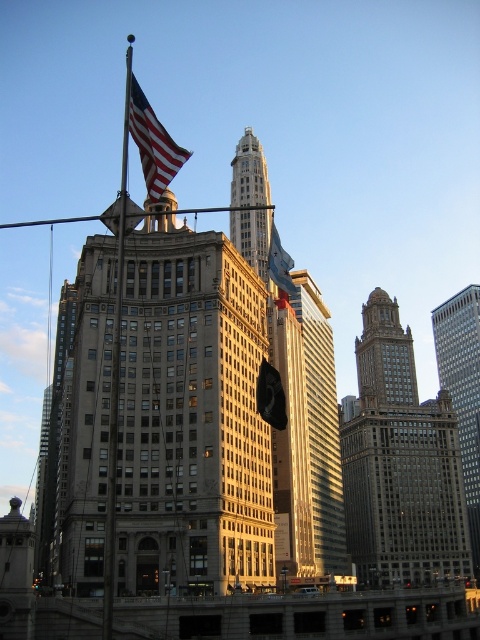
You are standing in the historic downtown area and notice the gold reflective glass skyscraper at center and the american flag at center. Which object is positioned to the right of the other?

The gold reflective glass skyscraper at center is to the right of the american flag at center.

You are a city planner trying to install a new streetlight between the gold reflective glass skyscraper at center and the american flag at center. The streetlight requires a minimum of 20 meters of space to avoid obstructing the view of the flag. Based on the scene, will the available space between them allow for the installation?

The distance between the gold reflective glass skyscraper at center and the american flag at center is 18.51 meters, which is less than the required 20 meters. Therefore, the streetlight cannot be installed without obstructing the view of the flag.